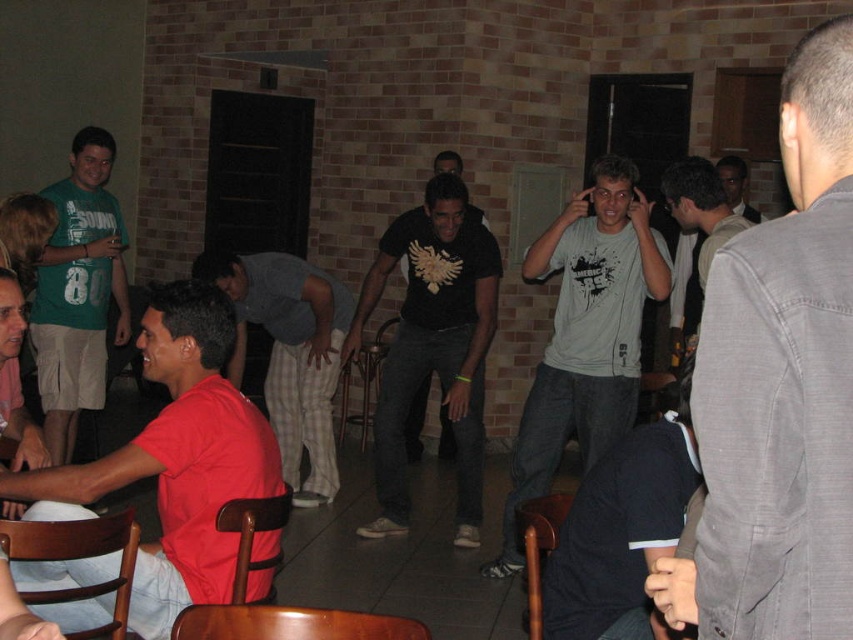
You are standing at the origin point of the room, which is at coordinates 0,0. You want to move towards the gray fabric shirt at right. What direction should you move in?

The gray fabric shirt at right is located at point [779,388], so you should move towards the right and forward to reach it.